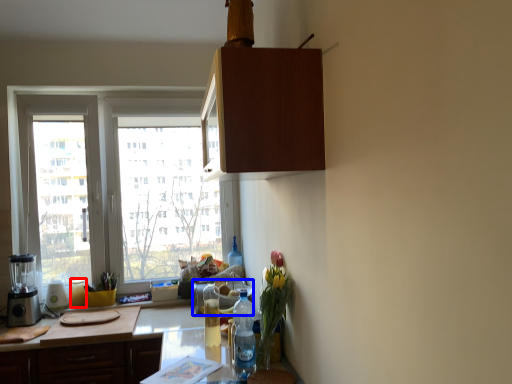
Question: Which point is closer to the camera, bottle (highlighted by a red box) or appliance (highlighted by a blue box)?

Choices:
 (A) bottle
 (B) appliance

Answer: (B)